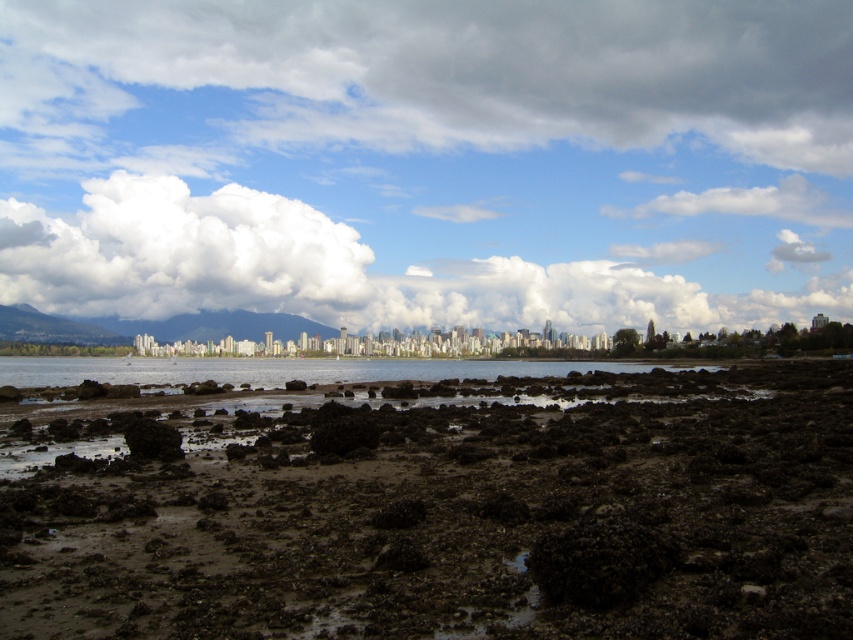
You are a photographer planning to capture the city skyline in the background. You notice the dull brown mud at center and the white fluffy cloud at upper left. Which object is positioned to the right of the other?

The dull brown mud at center is to the right of the white fluffy cloud at upper left.

You are standing on the shoreline and looking towards the city skyline. Which object, the dull brown mud at center or the cloudy sky at upper center, is closer to your eye level?

The dull brown mud at center is closer to your eye level than the cloudy sky at upper center because it is not as tall as the cloudy sky at upper center.

You are standing on the shore looking at the dull brown mud at center and the cloudy sky at upper center. Which object is located higher in the scene?

The cloudy sky at upper center is higher because it is positioned above the dull brown mud at center.